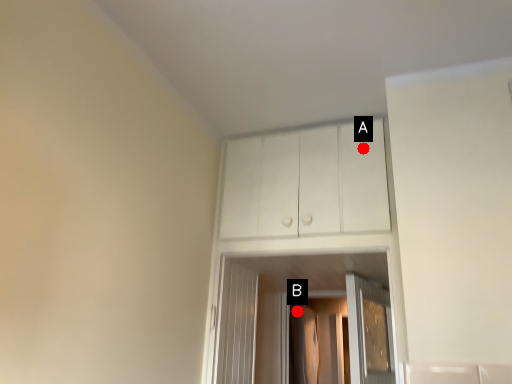
Question: Two points are circled on the image, labeled by A and B beside each circle. Among these points, which one is farthest from the camera?

Choices:
 (A) A is further
 (B) B is further

Answer: (B)